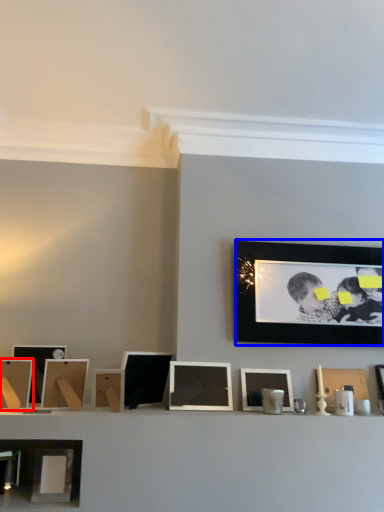
Question: Among these objects, which one is farthest to the camera, picture frame (highlighted by a red box) or picture frame (highlighted by a blue box)?

Choices:
 (A) picture frame
 (B) picture frame

Answer: (B)